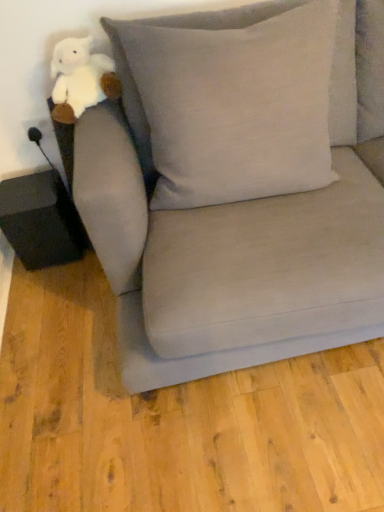
Question: Is white plush toy at upper left aimed at matte gray couch at center?

Choices:
 (A) yes
 (B) no

Answer: (A)

Question: Is white plush toy at upper left bigger than matte gray couch at center?

Choices:
 (A) no
 (B) yes

Answer: (A)

Question: Is white plush toy at upper left at the right side of matte gray couch at center?

Choices:
 (A) no
 (B) yes

Answer: (A)

Question: Considering the relative sizes of white plush toy at upper left and matte gray couch at center in the image provided, is white plush toy at upper left thinner than matte gray couch at center?

Choices:
 (A) yes
 (B) no

Answer: (A)

Question: From the image's perspective, is white plush toy at upper left located beneath matte gray couch at center?

Choices:
 (A) no
 (B) yes

Answer: (A)

Question: From a real-world perspective, is white plush toy at upper left beneath matte gray couch at center?

Choices:
 (A) no
 (B) yes

Answer: (A)

Question: Is matte gray couch at center not inside white plush toy at upper left?

Choices:
 (A) yes
 (B) no

Answer: (A)

Question: Could you tell me if matte gray couch at center is facing white plush toy at upper left?

Choices:
 (A) no
 (B) yes

Answer: (A)

Question: Is the depth of matte gray couch at center less than that of white plush toy at upper left?

Choices:
 (A) no
 (B) yes

Answer: (B)

Question: From the image's perspective, is matte gray couch at center on white plush toy at upper left?

Choices:
 (A) yes
 (B) no

Answer: (B)

Question: Can you confirm if matte gray couch at center is smaller than white plush toy at upper left?

Choices:
 (A) no
 (B) yes

Answer: (A)

Question: Does matte gray couch at center appear on the right side of white plush toy at upper left?

Choices:
 (A) no
 (B) yes

Answer: (B)

Question: Is matte gray couch at center turned away from light gray linen pillow at upper center?

Choices:
 (A) yes
 (B) no

Answer: (A)